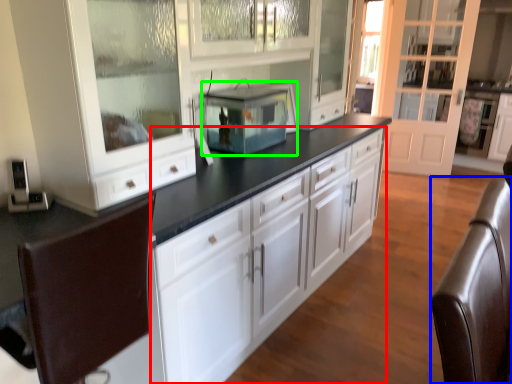
Question: Which object is the closest to the cabinetry (highlighted by a red box)? Choose among these: swivel chair (highlighted by a blue box) or home appliance (highlighted by a green box).

Choices:
 (A) swivel chair
 (B) home appliance

Answer: (B)